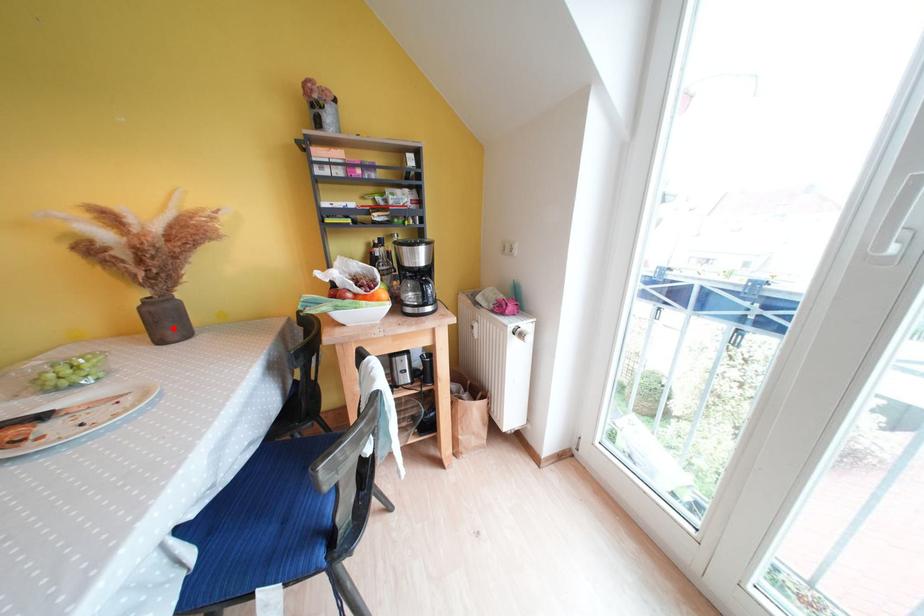
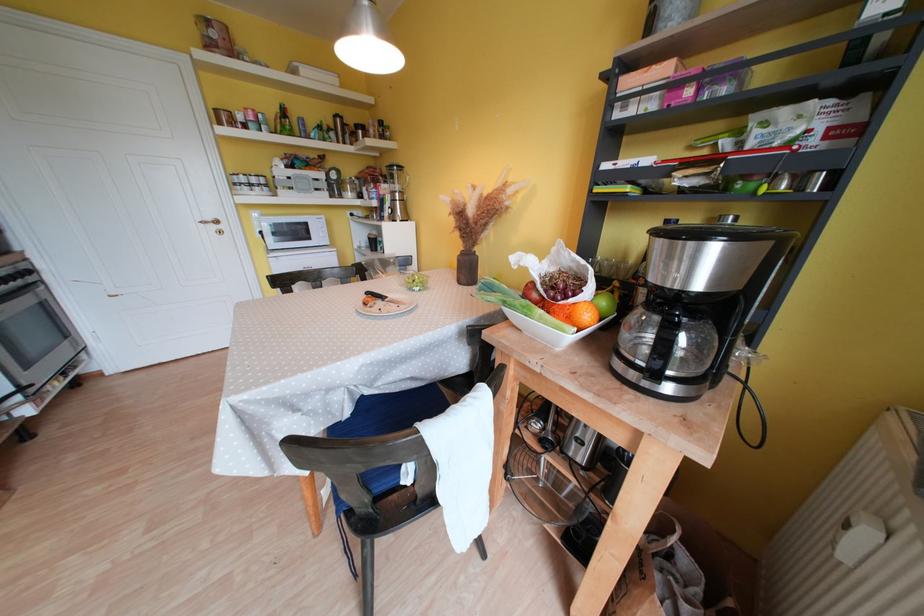
Question: I am providing you with two images of the same scene from different viewpoints. A red point is marked on the first image. Can you still see the location of the red point in image 2?

Choices:
 (A) Yes
 (B) No

Answer: (A)